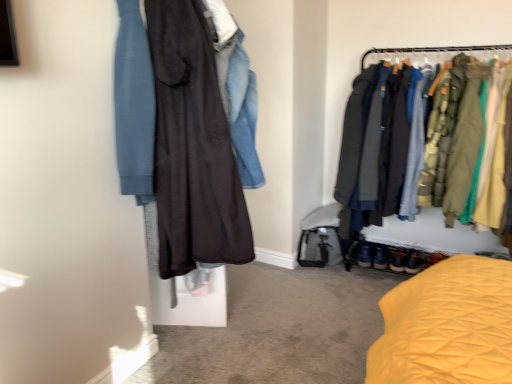
Question: From the image's perspective, is textured fabric jackets at right above dark matte dress at center?

Choices:
 (A) yes
 (B) no

Answer: (B)

Question: Can you confirm if textured fabric jackets at right is bigger than dark matte dress at center?

Choices:
 (A) yes
 (B) no

Answer: (A)

Question: Can you confirm if textured fabric jackets at right is positioned to the right of dark matte dress at center?

Choices:
 (A) no
 (B) yes

Answer: (B)

Question: Does textured fabric jackets at right come in front of dark matte dress at center?

Choices:
 (A) no
 (B) yes

Answer: (A)

Question: From a real-world perspective, is textured fabric jackets at right physically below dark matte dress at center?

Choices:
 (A) no
 (B) yes

Answer: (B)

Question: Considering the positions of dark matte dress at center and textured fabric jackets at right in the image, is dark matte dress at center wider or thinner than textured fabric jackets at right?

Choices:
 (A) thin
 (B) wide

Answer: (A)

Question: In terms of size, does dark matte dress at center appear bigger or smaller than textured fabric jackets at right?

Choices:
 (A) small
 (B) big

Answer: (A)

Question: From their relative heights in the image, would you say dark matte dress at center is taller or shorter than textured fabric jackets at right?

Choices:
 (A) short
 (B) tall

Answer: (A)

Question: Is dark matte dress at center spatially inside textured fabric jackets at right, or outside of it?

Choices:
 (A) outside
 (B) inside

Answer: (A)

Question: Is dark matte dress at center inside the boundaries of leather brown shoes at lower right, or outside?

Choices:
 (A) inside
 (B) outside

Answer: (B)

Question: From the image's perspective, is dark matte dress at center above or below leather brown shoes at lower right?

Choices:
 (A) above
 (B) below

Answer: (A)

Question: Considering the positions of dark matte dress at center and leather brown shoes at lower right in the image, is dark matte dress at center taller or shorter than leather brown shoes at lower right?

Choices:
 (A) short
 (B) tall

Answer: (B)

Question: Relative to leather brown shoes at lower right, is dark matte dress at center in front or behind?

Choices:
 (A) front
 (B) behind

Answer: (A)

Question: In terms of size, does textured fabric jackets at right appear bigger or smaller than leather brown shoes at lower right?

Choices:
 (A) big
 (B) small

Answer: (A)

Question: Is textured fabric jackets at right wider or thinner than leather brown shoes at lower right?

Choices:
 (A) wide
 (B) thin

Answer: (A)